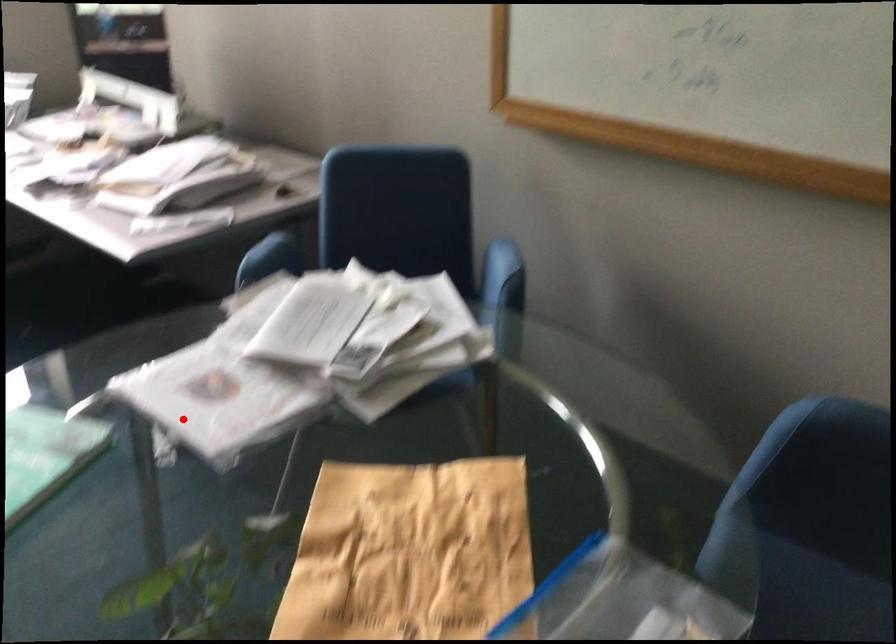
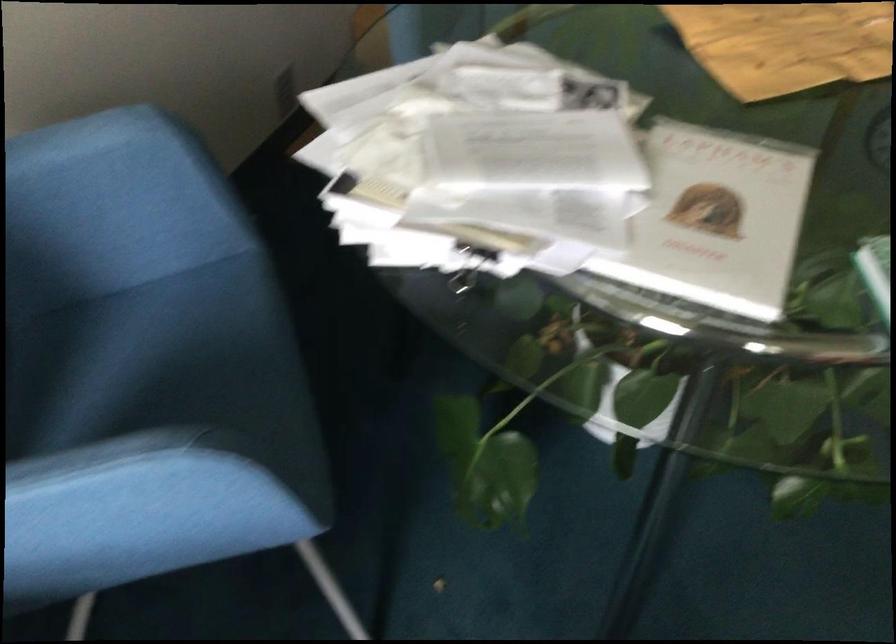
Question: I am providing you with two images of the same scene from different viewpoints. Image1 has a red point marked. In image2, the corresponding 3D location appears at what relative position? Reply with the corresponding letter.

Choices:
 (A) Closer
 (B) Farther

Answer: (A)